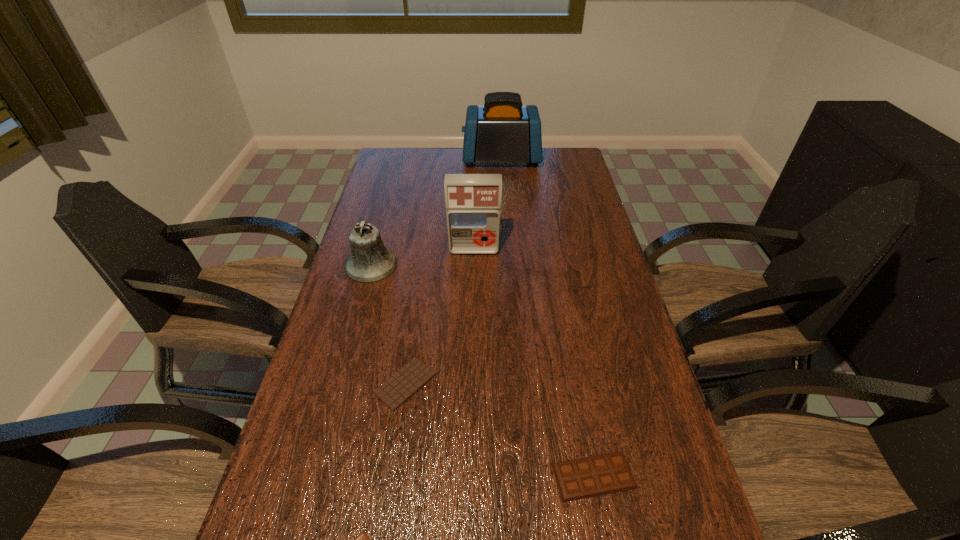
At what (x,y) coordinates should I click in order to perform the action: click on vacant space at the far edge of the desktop. Please return your answer as a coordinate pair (x, y). Image resolution: width=960 pixels, height=540 pixels. Looking at the image, I should click on (423, 150).

You are a GUI agent. You are given a task and a screenshot of the screen. Output one action in this format:
    pyautogui.click(x=<x>, y=<y>)
    Task: Click on the vacant point at the left edge
    The height and width of the screenshot is (540, 960).
    Given the screenshot: What is the action you would take?
    pyautogui.click(x=278, y=467)

In the image, there is a desktop. Where is `vacant space at the right edge`? vacant space at the right edge is located at coordinates (613, 392).

Where is `free point between the bell and the third shortest object`? free point between the bell and the third shortest object is located at coordinates (482, 370).

Where is `vacant region between the fourth shortest object and the first-aid kit`? The height and width of the screenshot is (540, 960). vacant region between the fourth shortest object and the first-aid kit is located at coordinates (422, 258).

Where is `free spot between the farthest object and the fourth farthest object`? free spot between the farthest object and the fourth farthest object is located at coordinates (453, 272).

Identify the location of free spot between the second shortest object and the first-aid kit. The height and width of the screenshot is (540, 960). (440, 317).

Image resolution: width=960 pixels, height=540 pixels. In order to click on blank region between the third tallest object and the first-aid kit in this screenshot , I will do `click(422, 258)`.

Locate an element on the screen. The image size is (960, 540). vacant point located between the first-aid kit and the fifth tallest object is located at coordinates (x=440, y=317).

What are the coordinates of `the fifth closest object relative to the first-aid kit` in the screenshot? It's located at (362, 539).